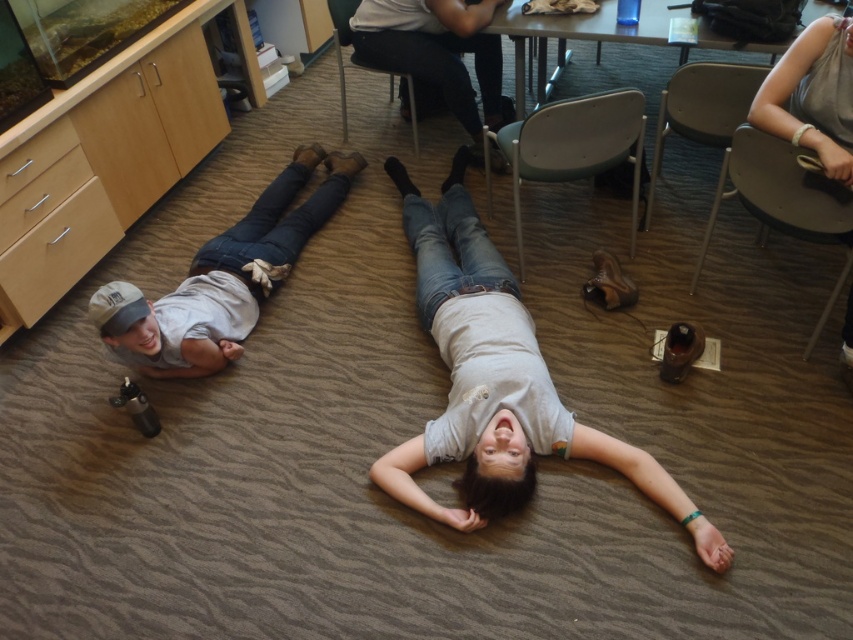
Question: Which of the following is the farthest from the observer?

Choices:
 (A) metallic gray table at upper center
 (B) metallic gray chair at upper right
 (C) dark gray jeans at center

Answer: (C)

Question: Does metallic gray chair at center appear under metallic gray chair at upper center?

Choices:
 (A) yes
 (B) no

Answer: (A)

Question: Does gray cotton shirt at left have a greater width compared to metallic gray table at upper center?

Choices:
 (A) no
 (B) yes

Answer: (A)

Question: Is metallic gray chair at center above metallic silver chair at upper right?

Choices:
 (A) no
 (B) yes

Answer: (B)

Question: Which object is the closest to the dark gray jeans at center?

Choices:
 (A) metallic gray chair at upper center
 (B) metallic silver chair at upper right
 (C) metallic gray table at upper center

Answer: (A)

Question: Which point is closer to the camera?

Choices:
 (A) dark gray jeans at center
 (B) metallic gray chair at upper right

Answer: (B)